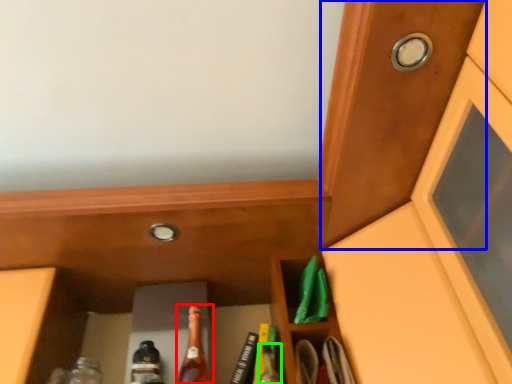
Question: Which object is positioned closest to beer bottle (highlighted by a red box)? Select from door (highlighted by a blue box) and bottle (highlighted by a green box).

Choices:
 (A) door
 (B) bottle

Answer: (B)